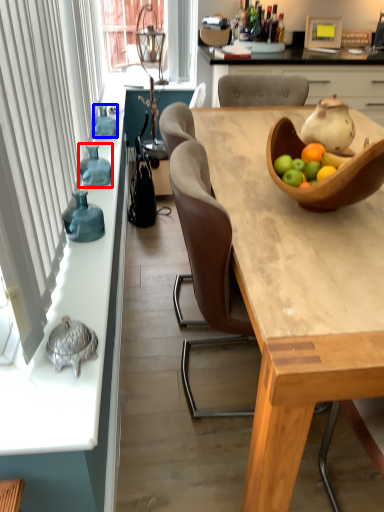
Question: Which object is closer to the camera taking this photo, vase (highlighted by a red box) or bottle (highlighted by a blue box)?

Choices:
 (A) vase
 (B) bottle

Answer: (A)